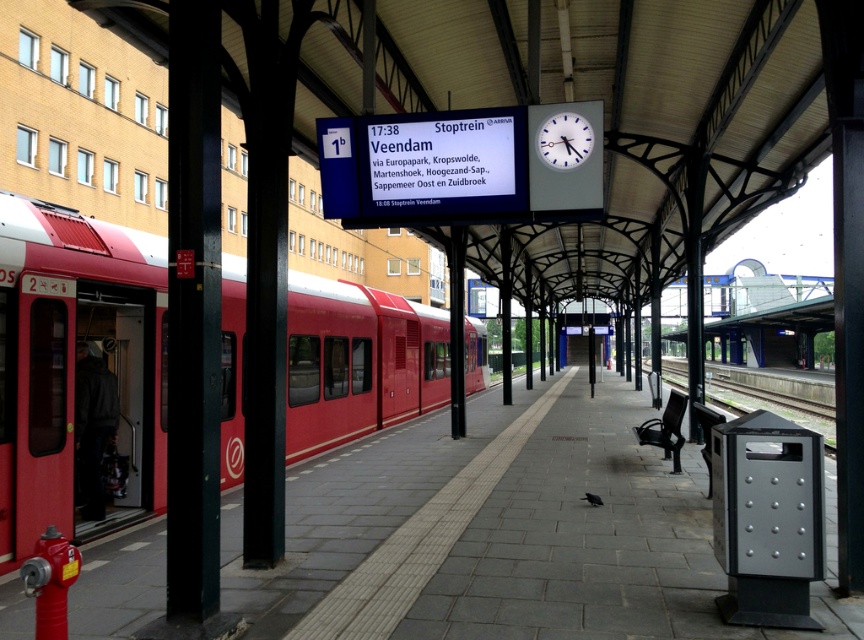
The width and height of the screenshot is (864, 640). What do you see at coordinates (545, 540) in the screenshot? I see `smooth concrete platform at center` at bounding box center [545, 540].

Which is below, smooth concrete platform at center or matte red train at left?

smooth concrete platform at center

Is point (437, 598) positioned behind point (106, 317)?

No, it is not.

I want to click on smooth concrete platform at center, so click(x=545, y=540).

Is smooth concrete platform at center taller than white plastic clock at upper center?

No, smooth concrete platform at center is not taller than white plastic clock at upper center.

Is point (540, 596) closer to viewer compared to point (566, 138)?

Yes.

Based on the photo, who is more distant from viewer, (424, 472) or (554, 140)?

Positioned behind is point (424, 472).

Where is `smooth concrete platform at center`? smooth concrete platform at center is located at coordinates (545, 540).

Can you confirm if matte red train at left is thinner than white plastic clock at upper center?

No, matte red train at left is not thinner than white plastic clock at upper center.

What are the coordinates of `matte red train at left` in the screenshot? It's located at (73, 365).

Image resolution: width=864 pixels, height=640 pixels. What are the coordinates of `matte red train at left` in the screenshot? It's located at (73, 365).